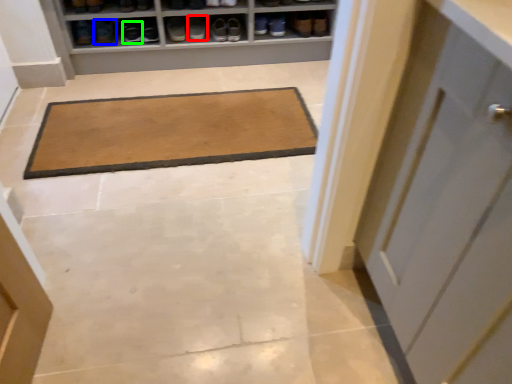
Question: Which object is the farthest from footwear (highlighted by a red box)? Choose among these: footwear (highlighted by a blue box) or footwear (highlighted by a green box).

Choices:
 (A) footwear
 (B) footwear

Answer: (A)